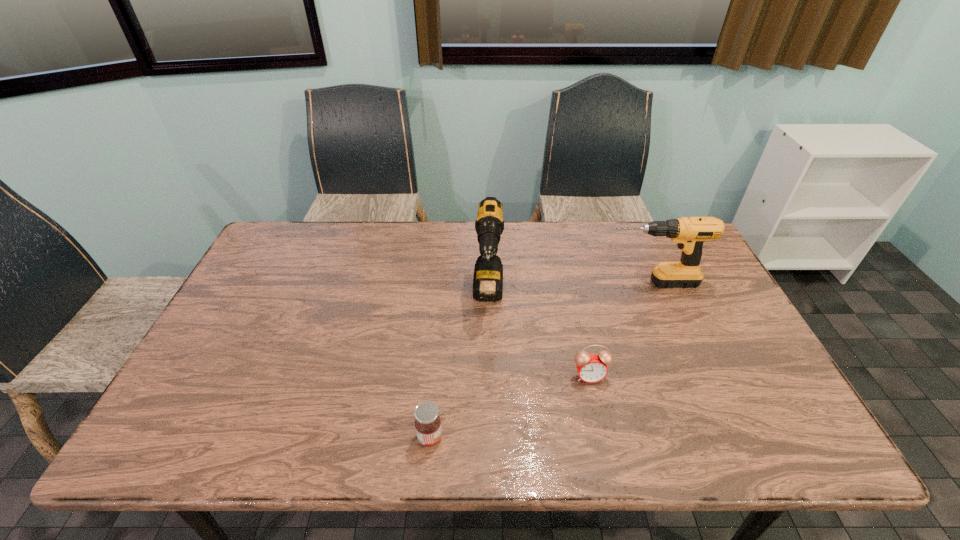
You are a GUI agent. You are given a task and a screenshot of the screen. Output one action in this format:
    pyautogui.click(x=<x>, y=<y>)
    Task: Click on the left drill
    This screenshot has height=540, width=960.
    Given the screenshot: What is the action you would take?
    pyautogui.click(x=488, y=273)

You are a GUI agent. You are given a task and a screenshot of the screen. Output one action in this format:
    pyautogui.click(x=<x>, y=<y>)
    Task: Click on the rightmost object
    The width and height of the screenshot is (960, 540).
    Given the screenshot: What is the action you would take?
    pyautogui.click(x=690, y=233)

Find the location of a particular element. Image resolution: width=960 pixels, height=540 pixels. the shorter drill is located at coordinates (690, 233).

The width and height of the screenshot is (960, 540). Find the location of `alarm clock`. alarm clock is located at coordinates (591, 368).

Where is `the second nearest object`? the second nearest object is located at coordinates (591, 368).

Identify the location of the nearest object. The image size is (960, 540). (427, 423).

This screenshot has height=540, width=960. Find the location of `jam`. jam is located at coordinates (427, 423).

Image resolution: width=960 pixels, height=540 pixels. What are the coordinates of `vacant area located at the tip of the left drill` in the screenshot? It's located at (490, 346).

The image size is (960, 540). Find the location of `vacant space located at the tip of the rightmost object`. vacant space located at the tip of the rightmost object is located at coordinates (490, 283).

The image size is (960, 540). I want to click on vacant point located at the tip of the rightmost object, so click(567, 283).